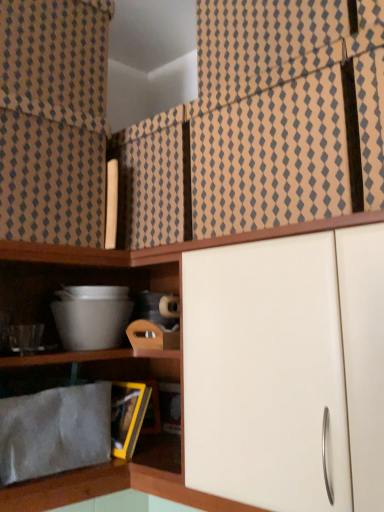
Question: Is the position of brown textured fabric at upper center, the second curtain in the left-to-right sequence, less distant than that of beige textured curtain at upper left, which ranks as the first curtain in left-to-right order?

Choices:
 (A) yes
 (B) no

Answer: (A)

Question: Is brown textured fabric at upper center, the second curtain in the left-to-right sequence, far away from beige textured curtain at upper left, arranged as the 2th curtain when viewed from the right?

Choices:
 (A) yes
 (B) no

Answer: (B)

Question: Is brown textured fabric at upper center, which ranks as the 1th curtain in right-to-left order, oriented towards beige textured curtain at upper left, which ranks as the first curtain in left-to-right order?

Choices:
 (A) yes
 (B) no

Answer: (B)

Question: Would you say beige textured curtain at upper left, arranged as the 2th curtain when viewed from the right, is part of brown textured fabric at upper center, the second curtain in the left-to-right sequence,'s contents?

Choices:
 (A) no
 (B) yes

Answer: (A)

Question: Does brown textured fabric at upper center, which ranks as the 1th curtain in right-to-left order, have a greater width compared to beige textured curtain at upper left, arranged as the 2th curtain when viewed from the right?

Choices:
 (A) yes
 (B) no

Answer: (A)

Question: Is brown textured fabric at upper center, the second curtain in the left-to-right sequence, to the left or to the right of beige textured curtain at upper left, which ranks as the first curtain in left-to-right order, in the image?

Choices:
 (A) right
 (B) left

Answer: (A)

Question: Considering the positions of point (218, 99) and point (26, 218), is point (218, 99) closer or farther from the camera than point (26, 218)?

Choices:
 (A) closer
 (B) farther

Answer: (B)

Question: From the image's perspective, relative to beige textured curtain at upper left, arranged as the 2th curtain when viewed from the right, is brown textured fabric at upper center, which ranks as the 1th curtain in right-to-left order, above or below?

Choices:
 (A) below
 (B) above

Answer: (B)

Question: From a real-world perspective, is brown textured fabric at upper center, the second curtain in the left-to-right sequence, positioned above or below beige textured curtain at upper left, which ranks as the first curtain in left-to-right order?

Choices:
 (A) above
 (B) below

Answer: (B)

Question: From the image's perspective, is gray fabric at lower left positioned above or below beige textured curtain at upper left, arranged as the 2th curtain when viewed from the right?

Choices:
 (A) above
 (B) below

Answer: (B)

Question: In the image, is gray fabric at lower left positioned in front of or behind beige textured curtain at upper left, arranged as the 2th curtain when viewed from the right?

Choices:
 (A) behind
 (B) front

Answer: (B)

Question: Do you think gray fabric at lower left is within beige textured curtain at upper left, arranged as the 2th curtain when viewed from the right, or outside of it?

Choices:
 (A) inside
 (B) outside

Answer: (B)

Question: Considering the positions of gray fabric at lower left and beige textured curtain at upper left, which ranks as the first curtain in left-to-right order, in the image, is gray fabric at lower left bigger or smaller than beige textured curtain at upper left, which ranks as the first curtain in left-to-right order,?

Choices:
 (A) big
 (B) small

Answer: (B)

Question: In terms of height, does brown textured fabric at upper center, the second curtain in the left-to-right sequence, look taller or shorter compared to gray fabric at lower left?

Choices:
 (A) short
 (B) tall

Answer: (B)

Question: Do you think brown textured fabric at upper center, the second curtain in the left-to-right sequence, is within gray fabric at lower left, or outside of it?

Choices:
 (A) inside
 (B) outside

Answer: (B)